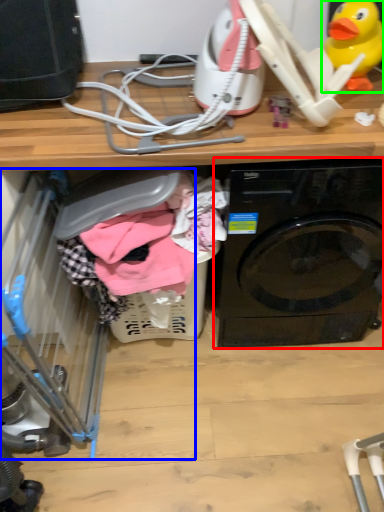
Question: Based on their relative distances, which object is farther from washing machine (highlighted by a red box)? Choose from baby carriage (highlighted by a blue box) and toy (highlighted by a green box).

Choices:
 (A) baby carriage
 (B) toy

Answer: (A)